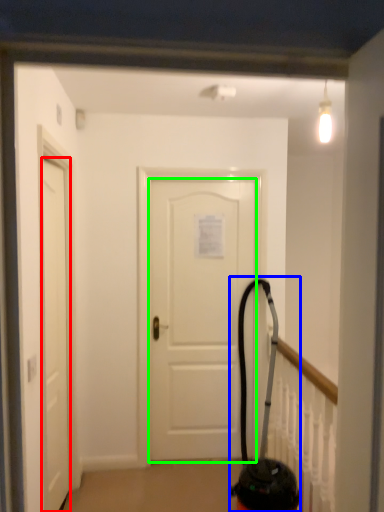
Question: Which is farther away from door (highlighted by a red box)? extinguisher (highlighted by a blue box) or door (highlighted by a green box)?

Choices:
 (A) extinguisher
 (B) door

Answer: (A)